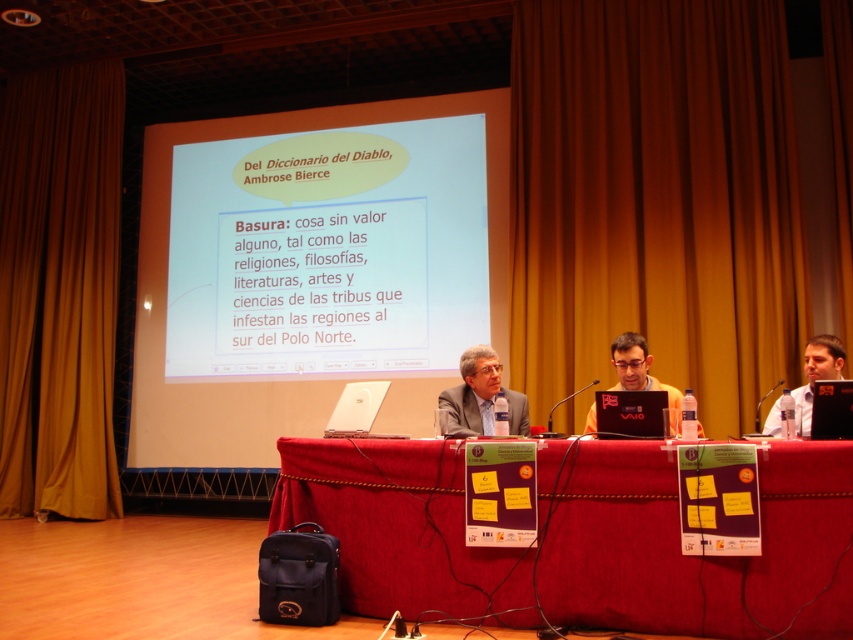
Between point (808, 356) and point (679, 396), which one is positioned in front?

Positioned in front is point (808, 356).

Describe the element at coordinates (816, 376) in the screenshot. I see `matte black laptop at right` at that location.

Between point (808, 404) and point (627, 353), which one is positioned in front?

Point (808, 404)

You are a GUI agent. You are given a task and a screenshot of the screen. Output one action in this format:
    pyautogui.click(x=<x>, y=<y>)
    Task: Click on the matte black laptop at right
    
    Given the screenshot: What is the action you would take?
    pyautogui.click(x=816, y=376)

Who is more forward, (x=706, y=416) or (x=605, y=419)?

Positioned in front is point (x=605, y=419).

Which is more to the left, brown velvet curtain at upper center or matte plastic screen at center?

matte plastic screen at center

At what (x,y) coordinates should I click in order to perform the action: click on brown velvet curtain at upper center. Please return your answer as a coordinate pair (x, y). The height and width of the screenshot is (640, 853). Looking at the image, I should click on (654, 196).

Does red fabric table at lower center have a greater height compared to matte black laptop at right?

Yes, red fabric table at lower center is taller than matte black laptop at right.

Between red fabric table at lower center and matte black laptop at right, which one is positioned lower?

red fabric table at lower center is below.

Is point (775, 456) closer to viewer compared to point (804, 413)?

Yes, point (775, 456) is in front of point (804, 413).

You are a GUI agent. You are given a task and a screenshot of the screen. Output one action in this format:
    pyautogui.click(x=<x>, y=<y>)
    Task: Click on the red fabric table at lower center
    The image size is (853, 640).
    Given the screenshot: What is the action you would take?
    pyautogui.click(x=697, y=556)